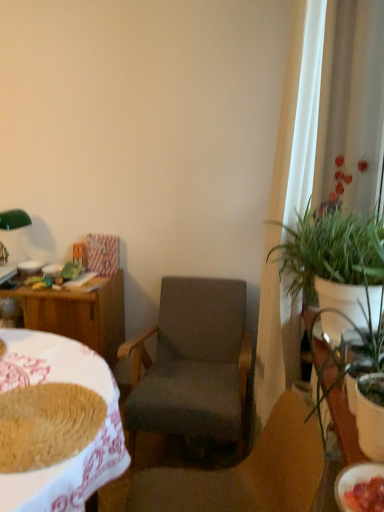
Find the location of a particular element. vacant location behind baked brown bread at lower left is located at coordinates (51, 362).